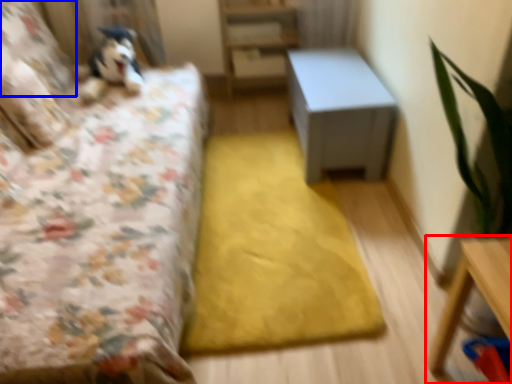
Question: Among these objects, which one is farthest to the camera, table (highlighted by a red box) or pillow (highlighted by a blue box)?

Choices:
 (A) table
 (B) pillow

Answer: (B)